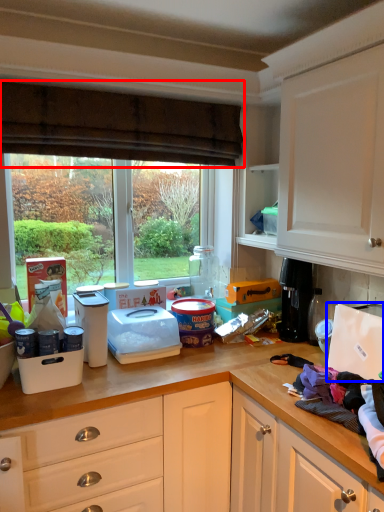
Question: Which object appears closest to the camera in this image, curtain (highlighted by a red box) or appliance (highlighted by a blue box)?

Choices:
 (A) curtain
 (B) appliance

Answer: (B)